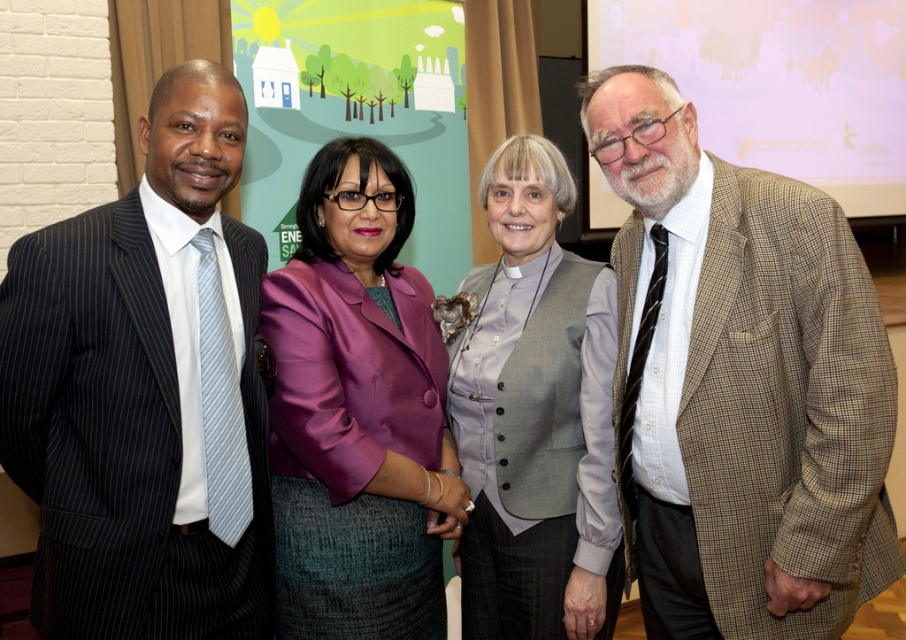
Does brown checkered suit at right lie behind gray buttoned vest at center?

No, it is in front of gray buttoned vest at center.

Is brown checkered suit at right to the left of gray buttoned vest at center from the viewer's perspective?

In fact, brown checkered suit at right is to the right of gray buttoned vest at center.

This screenshot has height=640, width=906. What do you see at coordinates (739, 384) in the screenshot? I see `brown checkered suit at right` at bounding box center [739, 384].

I want to click on brown checkered suit at right, so click(739, 384).

Does brown checkered suit at right have a greater height compared to matte black suit at left?

Indeed, brown checkered suit at right has a greater height compared to matte black suit at left.

What do you see at coordinates (739, 384) in the screenshot? This screenshot has width=906, height=640. I see `brown checkered suit at right` at bounding box center [739, 384].

Between point (628, 100) and point (32, 353), which one is positioned in front?

Positioned in front is point (32, 353).

Find the location of `brown checkered suit at right`. brown checkered suit at right is located at coordinates (739, 384).

Can you confirm if matte black suit at left is positioned to the right of purple satin blazer at center?

In fact, matte black suit at left is to the left of purple satin blazer at center.

Is point (108, 604) farther from camera compared to point (429, 429)?

No, it is not.

Image resolution: width=906 pixels, height=640 pixels. I want to click on matte black suit at left, so click(x=140, y=392).